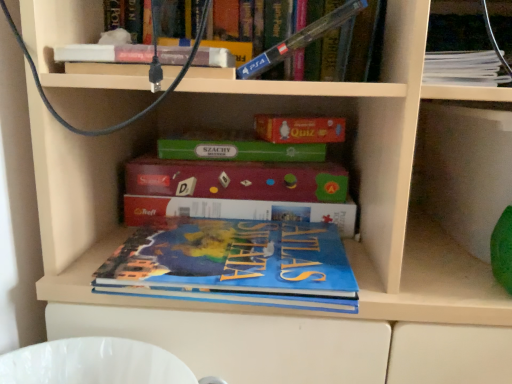
Identify the location of blue matte atlas book at center, placed as the 1th book when sorted from bottom to top. The image size is (512, 384). (234, 264).

From a real-world perspective, is blue matte atlas book at center, positioned as the fourth book in top-to-bottom order, positioned above or below white paper stack at upper right, the 1th book viewed from the top?

Clearly, from a real-world perspective, blue matte atlas book at center, positioned as the fourth book in top-to-bottom order, is below white paper stack at upper right, the 1th book viewed from the top.

In the scene shown: Can you confirm if blue matte atlas book at center, positioned as the fourth book in top-to-bottom order, is thinner than white paper stack at upper right, the 1th book viewed from the top?

No.

Considering the relative sizes of blue matte atlas book at center, positioned as the fourth book in top-to-bottom order, and white paper stack at upper right, which ranks as the fourth book in bottom-to-top order, in the image provided, is blue matte atlas book at center, positioned as the fourth book in top-to-bottom order, shorter than white paper stack at upper right, which ranks as the fourth book in bottom-to-top order,?

Correct, blue matte atlas book at center, positioned as the fourth book in top-to-bottom order, is not as tall as white paper stack at upper right, which ranks as the fourth book in bottom-to-top order.

You are a GUI agent. You are given a task and a screenshot of the screen. Output one action in this format:
    pyautogui.click(x=<x>, y=<y>)
    Task: Click on the 3rd book positioned above the blue matte atlas book at center, placed as the 1th book when sorted from bottom to top (from the image's perspective)
    
    Given the screenshot: What is the action you would take?
    pyautogui.click(x=463, y=68)

What's the angular difference between blue matte atlas book at center, placed as the 1th book when sorted from bottom to top, and blue plastic ps4 controller at upper center, acting as the third book starting from the bottom,'s facing directions?

The facing directions of blue matte atlas book at center, placed as the 1th book when sorted from bottom to top, and blue plastic ps4 controller at upper center, acting as the third book starting from the bottom, are 3.05 degrees apart.

Is blue plastic ps4 controller at upper center, positioned as the second book in top-to-bottom order, at the back of blue matte atlas book at center, placed as the 1th book when sorted from bottom to top?

No, blue matte atlas book at center, placed as the 1th book when sorted from bottom to top, is not facing away from blue plastic ps4 controller at upper center, positioned as the second book in top-to-bottom order.

In terms of width, does blue matte atlas book at center, placed as the 1th book when sorted from bottom to top, look wider or thinner when compared to blue plastic ps4 controller at upper center, positioned as the second book in top-to-bottom order?

blue matte atlas book at center, placed as the 1th book when sorted from bottom to top, is wider than blue plastic ps4 controller at upper center, positioned as the second book in top-to-bottom order.

Is the surface of blue matte atlas book at center, positioned as the fourth book in top-to-bottom order, in direct contact with blue plastic ps4 controller at upper center, acting as the third book starting from the bottom?

blue matte atlas book at center, positioned as the fourth book in top-to-bottom order, and blue plastic ps4 controller at upper center, acting as the third book starting from the bottom, are not in contact.

Which is more to the right, blue matte atlas book at center, placed as the 1th book when sorted from bottom to top, or blue cardboard puzzle at center, arranged as the second book when ordered from the bottom?

From the viewer's perspective, blue matte atlas book at center, placed as the 1th book when sorted from bottom to top, appears more on the right side.

Which object is thinner, blue matte atlas book at center, placed as the 1th book when sorted from bottom to top, or blue cardboard puzzle at center, arranged as the second book when ordered from the bottom?

With smaller width is blue cardboard puzzle at center, arranged as the second book when ordered from the bottom.

From the image's perspective, is blue matte atlas book at center, placed as the 1th book when sorted from bottom to top, on blue cardboard puzzle at center, the 3th book viewed from the top?

No, from the image's perspective, blue matte atlas book at center, placed as the 1th book when sorted from bottom to top, is not above blue cardboard puzzle at center, the 3th book viewed from the top.

Are blue matte atlas book at center, placed as the 1th book when sorted from bottom to top, and blue cardboard puzzle at center, arranged as the second book when ordered from the bottom, far apart?

blue matte atlas book at center, placed as the 1th book when sorted from bottom to top, is actually quite close to blue cardboard puzzle at center, arranged as the second book when ordered from the bottom.

Is blue plastic ps4 controller at upper center, acting as the third book starting from the bottom, facing away from blue matte atlas book at center, positioned as the fourth book in top-to-bottom order?

blue plastic ps4 controller at upper center, acting as the third book starting from the bottom, is not turned away from blue matte atlas book at center, positioned as the fourth book in top-to-bottom order.

How many degrees apart are the facing directions of blue plastic ps4 controller at upper center, positioned as the second book in top-to-bottom order, and blue matte atlas book at center, positioned as the fourth book in top-to-bottom order?

They differ by 3.05 degrees in their facing directions.

Is blue plastic ps4 controller at upper center, acting as the third book starting from the bottom, touching blue matte atlas book at center, positioned as the fourth book in top-to-bottom order?

No, blue plastic ps4 controller at upper center, acting as the third book starting from the bottom, is not in contact with blue matte atlas book at center, positioned as the fourth book in top-to-bottom order.

Considering the relative sizes of white paper stack at upper right, the 1th book viewed from the top, and blue cardboard puzzle at center, the 3th book viewed from the top, in the image provided, is white paper stack at upper right, the 1th book viewed from the top, bigger than blue cardboard puzzle at center, the 3th book viewed from the top,?

Yes.

Locate an element on the screen. the 3rd book to the right of the blue cardboard puzzle at center, the 3th book viewed from the top, starting your count from the anchor is located at coordinates (463, 68).

Which of these two, white paper stack at upper right, which ranks as the fourth book in bottom-to-top order, or blue cardboard puzzle at center, the 3th book viewed from the top, is wider?

With larger width is white paper stack at upper right, which ranks as the fourth book in bottom-to-top order.

From a real-world perspective, is white paper stack at upper right, the 1th book viewed from the top, above or below blue cardboard puzzle at center, the 3th book viewed from the top?

From a real-world perspective, white paper stack at upper right, the 1th book viewed from the top, is physically above blue cardboard puzzle at center, the 3th book viewed from the top.

Could you tell me if blue cardboard puzzle at center, arranged as the second book when ordered from the bottom, is facing white paper stack at upper right, which ranks as the fourth book in bottom-to-top order?

No, blue cardboard puzzle at center, arranged as the second book when ordered from the bottom, is not oriented towards white paper stack at upper right, which ranks as the fourth book in bottom-to-top order.

Considering their positions, is blue cardboard puzzle at center, the 3th book viewed from the top, located in front of or behind white paper stack at upper right, which ranks as the fourth book in bottom-to-top order?

Visually, blue cardboard puzzle at center, the 3th book viewed from the top, is located behind white paper stack at upper right, which ranks as the fourth book in bottom-to-top order.

How many degrees apart are the facing directions of blue cardboard puzzle at center, arranged as the second book when ordered from the bottom, and white paper stack at upper right, the 1th book viewed from the top?

The angular difference between blue cardboard puzzle at center, arranged as the second book when ordered from the bottom, and white paper stack at upper right, the 1th book viewed from the top, is 0.95 degrees.

From their relative heights in the image, would you say blue cardboard puzzle at center, the 3th book viewed from the top, is taller or shorter than white paper stack at upper right, which ranks as the fourth book in bottom-to-top order?

blue cardboard puzzle at center, the 3th book viewed from the top, is taller than white paper stack at upper right, which ranks as the fourth book in bottom-to-top order.

Considering the relative positions of blue cardboard puzzle at center, arranged as the second book when ordered from the bottom, and blue matte atlas book at center, positioned as the fourth book in top-to-bottom order, in the image provided, is blue cardboard puzzle at center, arranged as the second book when ordered from the bottom, to the left or to the right of blue matte atlas book at center, positioned as the fourth book in top-to-bottom order,?

Based on their positions, blue cardboard puzzle at center, arranged as the second book when ordered from the bottom, is located to the left of blue matte atlas book at center, positioned as the fourth book in top-to-bottom order.

Is blue cardboard puzzle at center, the 3th book viewed from the top, positioned in front of blue matte atlas book at center, positioned as the fourth book in top-to-bottom order?

No.

From a real-world perspective, which is physically above, blue cardboard puzzle at center, the 3th book viewed from the top, or blue matte atlas book at center, positioned as the fourth book in top-to-bottom order?

In real-world perspective, blue cardboard puzzle at center, the 3th book viewed from the top, is above.

Where is `the 2nd book behind the blue matte atlas book at center, placed as the 1th book when sorted from bottom to top`? This screenshot has height=384, width=512. the 2nd book behind the blue matte atlas book at center, placed as the 1th book when sorted from bottom to top is located at coordinates (463, 68).

From the image's perspective, count 2nd books downward from the blue plastic ps4 controller at upper center, positioned as the second book in top-to-bottom order, and point to it. Please provide its 2D coordinates.

[(234, 264)]

When comparing their distances from white paper stack at upper right, the 1th book viewed from the top, does blue cardboard puzzle at center, the 3th book viewed from the top, or blue matte atlas book at center, positioned as the fourth book in top-to-bottom order, seem further?

blue matte atlas book at center, positioned as the fourth book in top-to-bottom order.

Estimate the real-world distances between objects in this image. Which object is closer to blue plastic ps4 controller at upper center, acting as the third book starting from the bottom, blue cardboard puzzle at center, arranged as the second book when ordered from the bottom, or white paper stack at upper right, which ranks as the fourth book in bottom-to-top order?

white paper stack at upper right, which ranks as the fourth book in bottom-to-top order, lies closer to blue plastic ps4 controller at upper center, acting as the third book starting from the bottom, than the other object.

Estimate the real-world distances between objects in this image. Which object is further from blue plastic ps4 controller at upper center, acting as the third book starting from the bottom, blue matte atlas book at center, placed as the 1th book when sorted from bottom to top, or white paper stack at upper right, the 1th book viewed from the top?

Based on the image, blue matte atlas book at center, placed as the 1th book when sorted from bottom to top, appears to be further to blue plastic ps4 controller at upper center, acting as the third book starting from the bottom.

Which object lies further to the anchor point blue cardboard puzzle at center, arranged as the second book when ordered from the bottom, blue matte atlas book at center, placed as the 1th book when sorted from bottom to top, or blue plastic ps4 controller at upper center, acting as the third book starting from the bottom?

blue plastic ps4 controller at upper center, acting as the third book starting from the bottom, is further to blue cardboard puzzle at center, arranged as the second book when ordered from the bottom.

Considering their positions, is blue cardboard puzzle at center, the 3th book viewed from the top, positioned closer to blue matte atlas book at center, positioned as the fourth book in top-to-bottom order, than white paper stack at upper right, the 1th book viewed from the top?

blue cardboard puzzle at center, the 3th book viewed from the top.

Considering their positions, is blue plastic ps4 controller at upper center, positioned as the second book in top-to-bottom order, positioned further to blue matte atlas book at center, placed as the 1th book when sorted from bottom to top, than blue cardboard puzzle at center, arranged as the second book when ordered from the bottom?

The object further to blue matte atlas book at center, placed as the 1th book when sorted from bottom to top, is blue plastic ps4 controller at upper center, positioned as the second book in top-to-bottom order.

Which object lies nearer to the anchor point blue cardboard puzzle at center, the 3th book viewed from the top, blue matte atlas book at center, positioned as the fourth book in top-to-bottom order, or white paper stack at upper right, which ranks as the fourth book in bottom-to-top order?

The object closer to blue cardboard puzzle at center, the 3th book viewed from the top, is blue matte atlas book at center, positioned as the fourth book in top-to-bottom order.

Estimate the real-world distances between objects in this image. Which object is further from blue plastic ps4 controller at upper center, positioned as the second book in top-to-bottom order, white paper stack at upper right, the 1th book viewed from the top, or blue matte atlas book at center, placed as the 1th book when sorted from bottom to top?

blue matte atlas book at center, placed as the 1th book when sorted from bottom to top, lies further to blue plastic ps4 controller at upper center, positioned as the second book in top-to-bottom order, than the other object.

At what (x,y) coordinates should I click in order to perform the action: click on book between blue plastic ps4 controller at upper center, positioned as the second book in top-to-bottom order, and blue matte atlas book at center, placed as the 1th book when sorted from bottom to top, vertically. Please return your answer as a coordinate pair (x, y). The height and width of the screenshot is (384, 512). Looking at the image, I should click on (238, 210).

The height and width of the screenshot is (384, 512). I want to click on book between blue matte atlas book at center, placed as the 1th book when sorted from bottom to top, and white paper stack at upper right, which ranks as the fourth book in bottom-to-top order, from left to right, so click(300, 40).